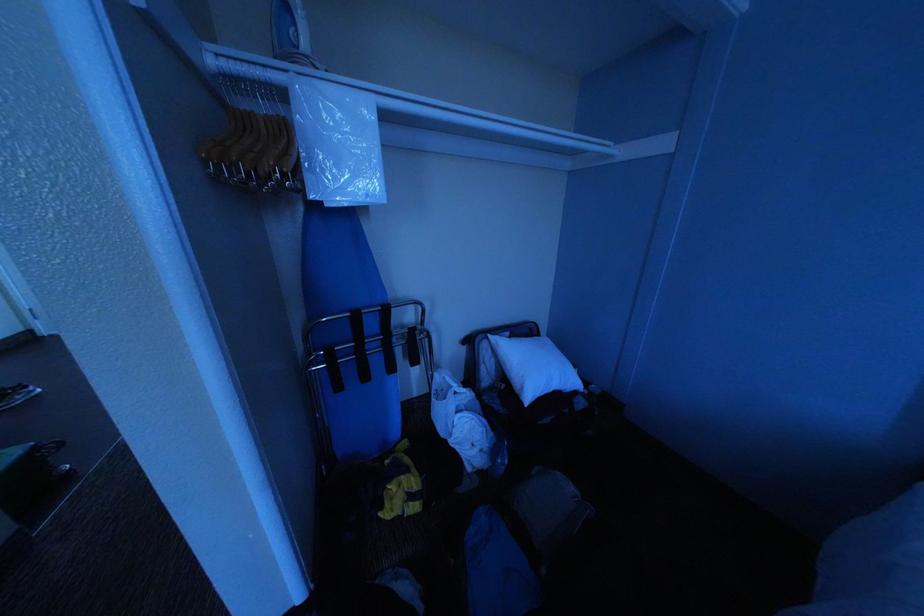
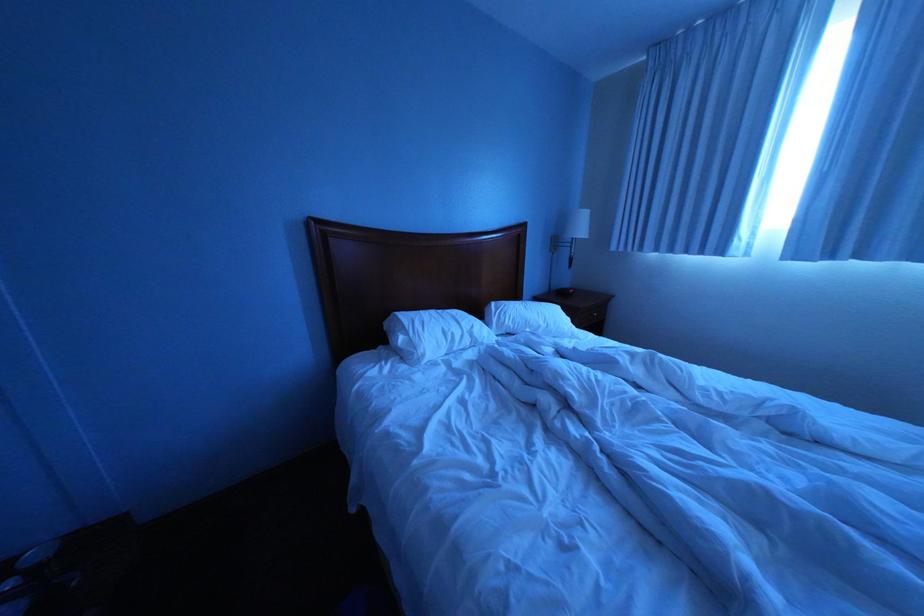
Looking at this image, based on the continuous images, in which direction is the camera rotating?

The rotation direction of the camera is right-down.